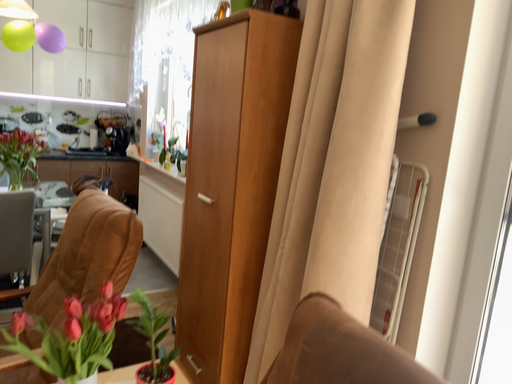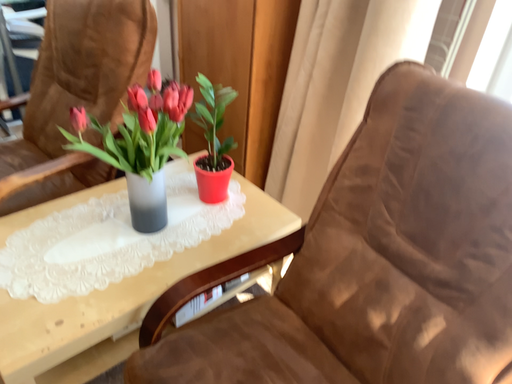
Question: How did the camera likely rotate when shooting the video?

Choices:
 (A) rotated right
 (B) rotated left

Answer: (A)